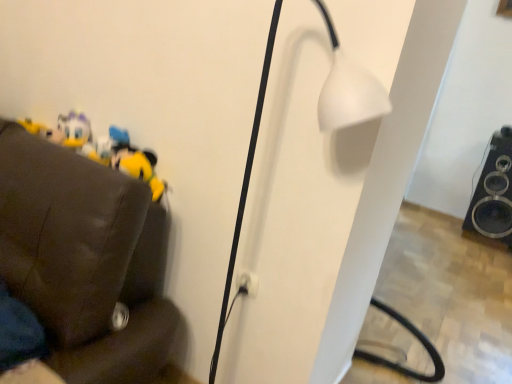
Question: Is white plastic electric outlet at center situated inside yellow plush toy at left or outside?

Choices:
 (A) inside
 (B) outside

Answer: (B)

Question: Is point (246, 291) closer or farther from the camera than point (132, 162)?

Choices:
 (A) closer
 (B) farther

Answer: (A)

Question: Estimate the real-world distances between objects in this image. Which object is farther from the white matte lamp at center?

Choices:
 (A) white plastic electric outlet at center
 (B) yellow plush toy at left
 (C) black glossy speaker at lower right

Answer: (C)

Question: Which object is positioned closest to the yellow plush toy at left?

Choices:
 (A) black glossy speaker at lower right
 (B) white plastic electric outlet at center
 (C) white matte lamp at center

Answer: (B)